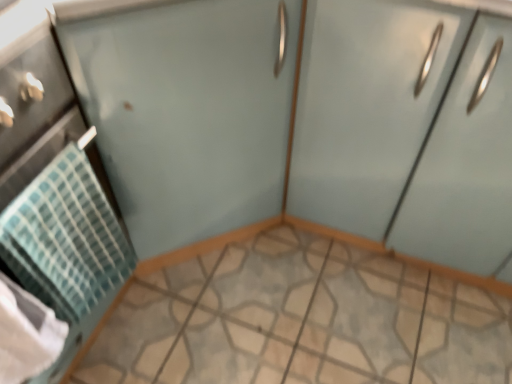
Question: Looking at their shapes, would you say teal woven towel at left is wider or thinner than matte teal towel at left?

Choices:
 (A) wide
 (B) thin

Answer: (B)

Question: Considering their positions, is teal woven towel at left located in front of or behind matte teal towel at left?

Choices:
 (A) behind
 (B) front

Answer: (A)

Question: Which is nearer to the matte light blue cabinet at right?

Choices:
 (A) teal woven towel at left
 (B) clear glass screen door at upper right
 (C) matte teal towel at left

Answer: (B)

Question: Considering the real-world distances, which object is closest to the teal woven towel at left?

Choices:
 (A) matte light blue cabinet at right
 (B) clear glass screen door at upper right
 (C) matte teal towel at left

Answer: (C)